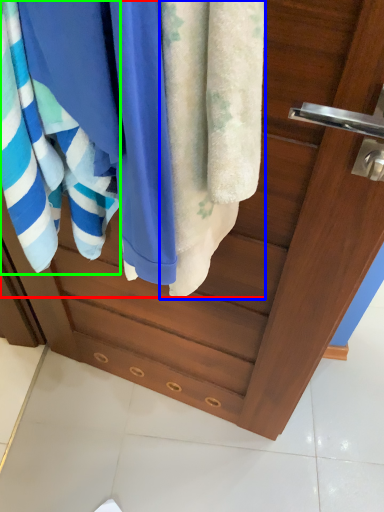
Question: Estimate the real-world distances between objects in this image. Which object is farther from beach towel (highlighted by a red box), towel (highlighted by a blue box) or towel (highlighted by a green box)?

Choices:
 (A) towel
 (B) towel

Answer: (B)